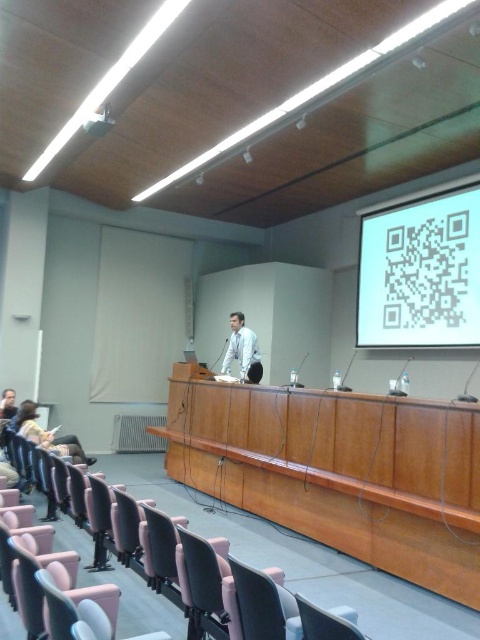
Measure the distance between matte pink chair at lower left and camera.

matte pink chair at lower left and camera are 5.08 feet apart from each other.

Between matte pink chair at lower left and dark brown hair at lower left, which one has less height?

With less height is dark brown hair at lower left.

Which is in front, point (83, 611) or point (4, 403)?

Point (83, 611) is in front.

Locate an element on the screen. matte pink chair at lower left is located at coordinates (79, 609).

Can you confirm if white glossy shirt at center is shorter than white glossy projector at upper center?

In fact, white glossy shirt at center may be taller than white glossy projector at upper center.

Can you confirm if white glossy shirt at center is taller than white glossy projector at upper center?

Yes, white glossy shirt at center is taller than white glossy projector at upper center.

Is point (256, 369) farther from camera compared to point (97, 128)?

That is True.

Find the location of a particular element. white glossy shirt at center is located at coordinates (241, 349).

Does white matte qr code at upper right have a lesser height compared to light brown leather chair at lower left?

Incorrect, white matte qr code at upper right's height does not fall short of light brown leather chair at lower left's.

Is white matte qr code at upper right to the right of light brown leather chair at lower left from the viewer's perspective?

Yes, white matte qr code at upper right is to the right of light brown leather chair at lower left.

Image resolution: width=480 pixels, height=640 pixels. I want to click on white matte qr code at upper right, so click(x=420, y=269).